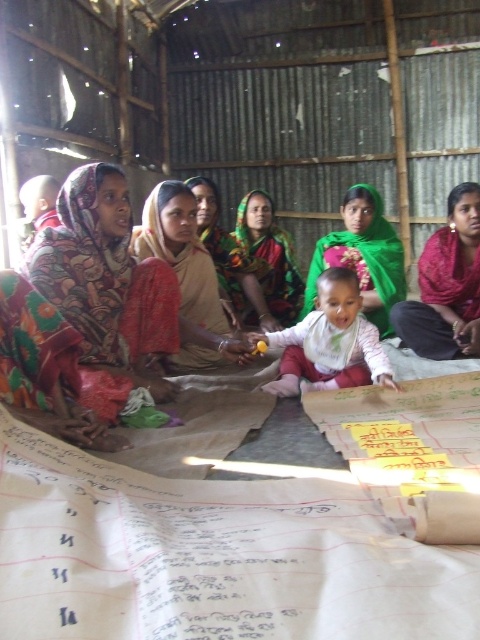
Does white soft baby at center have a greater width compared to green fabric at center?

Incorrect, white soft baby at center's width does not surpass green fabric at center's.

Between point (339, 358) and point (385, 324), which one is positioned in front?

Point (339, 358) is in front.

Which is behind, point (345, 348) or point (371, 218)?

The point (371, 218) is behind.

Find the location of a particular element. The height and width of the screenshot is (640, 480). white soft baby at center is located at coordinates (330, 342).

Can you confirm if red fabric headscarf at center is shorter than white soft baby at center?

Incorrect, red fabric headscarf at center's height does not fall short of white soft baby at center's.

Which of these two, red fabric headscarf at center or white soft baby at center, stands taller?

With more height is red fabric headscarf at center.

Which is in front, point (468, 291) or point (327, 310)?

Point (327, 310) is more forward.

The image size is (480, 640). I want to click on red fabric headscarf at center, so click(446, 285).

Who is shorter, red fabric headscarf at center or green fabric headscarf at center?

green fabric headscarf at center

Who is more forward, (427, 289) or (289, 269)?

Point (427, 289) is more forward.

Is point (424, 332) farther from viewer compared to point (259, 198)?

No, (424, 332) is in front of (259, 198).

At what (x,y) coordinates should I click in order to perform the action: click on red fabric headscarf at center. Please return your answer as a coordinate pair (x, y). The image size is (480, 640). Looking at the image, I should click on (446, 285).